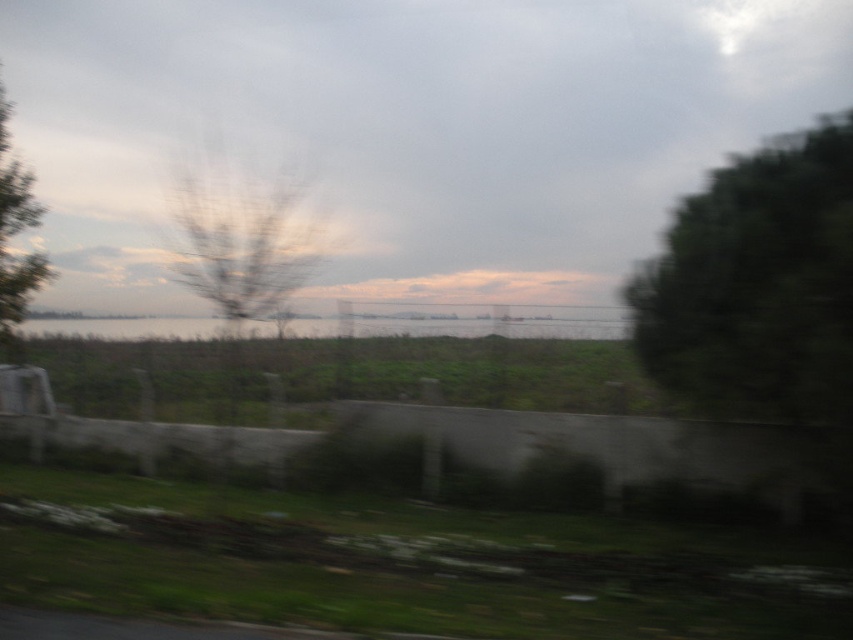
Question: Does green leafy tree at right have a larger size compared to clear water at center?

Choices:
 (A) yes
 (B) no

Answer: (B)

Question: Which point appears closest to the camera in this image?

Choices:
 (A) click(x=9, y=166)
 (B) click(x=137, y=333)
 (C) click(x=277, y=228)

Answer: (C)

Question: Is green leafy tree at right thinner than clear water at center?

Choices:
 (A) yes
 (B) no

Answer: (A)

Question: Which point is farther to the camera?

Choices:
 (A) green leafy tree at right
 (B) green leafy tree at left
 (C) brown leafless branches at center
 (D) clear water at center

Answer: (B)

Question: Which point is farther to the camera?

Choices:
 (A) (0, 164)
 (B) (805, 342)
 (C) (223, 332)
 (D) (42, 332)

Answer: (D)

Question: Can you confirm if brown leafless branches at center is thinner than clear water at center?

Choices:
 (A) no
 (B) yes

Answer: (B)